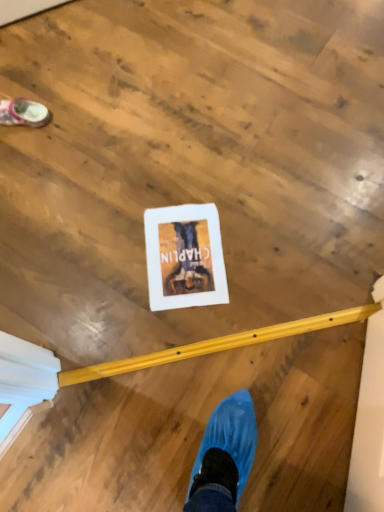
Image resolution: width=384 pixels, height=512 pixels. In order to click on space that is in front of white paper at center in this screenshot , I will do `click(190, 345)`.